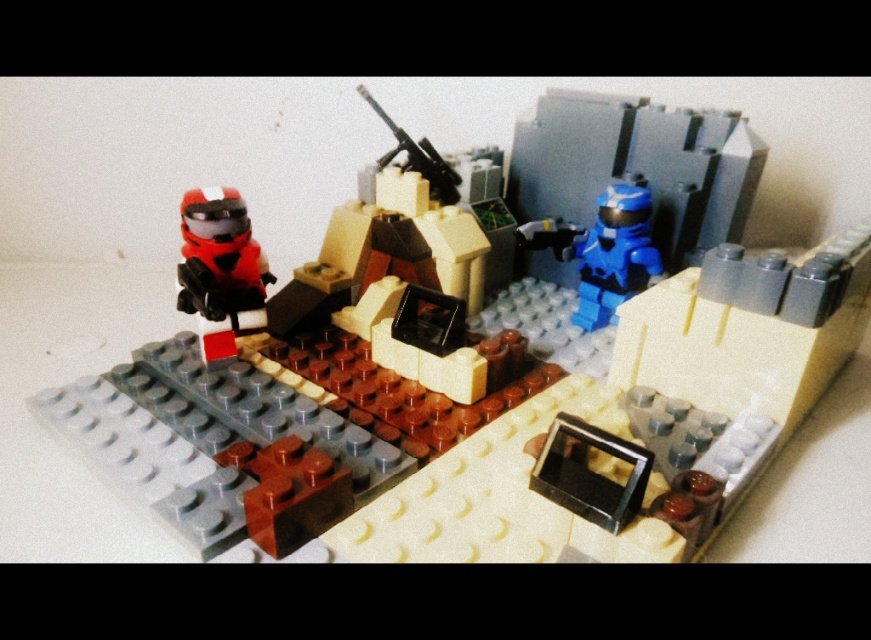
Question: Does matte black helmet at upper left have a greater width compared to matte orange helmet at left?

Choices:
 (A) yes
 (B) no

Answer: (A)

Question: Does matte black helmet at upper left have a lesser width compared to matte orange helmet at left?

Choices:
 (A) no
 (B) yes

Answer: (A)

Question: Which of the following is the closest to the observer?

Choices:
 (A) (397, 134)
 (B) (223, 195)
 (C) (768, 97)

Answer: (B)

Question: Which object is closer to the camera taking this photo?

Choices:
 (A) metallic gun at center
 (B) matte orange helmet at left
 (C) matte black helmet at upper left

Answer: (C)

Question: Does matte black helmet at upper left have a smaller size compared to matte orange helmet at left?

Choices:
 (A) yes
 (B) no

Answer: (B)

Question: Which point is closer to the camera taking this photo?

Choices:
 (A) (845, 474)
 (B) (201, 332)
 (C) (447, 177)

Answer: (A)